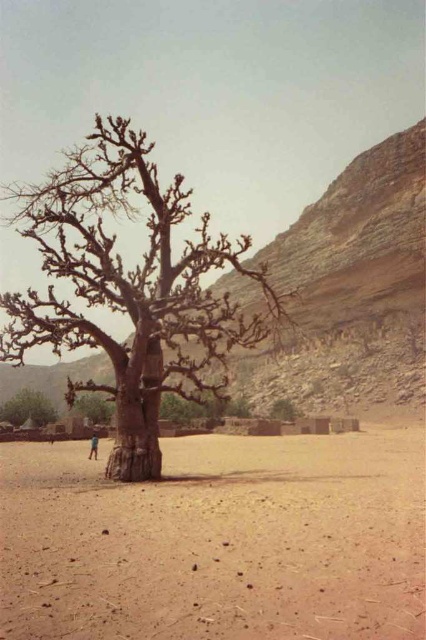
Does brown rough textured tree at center lie behind brown rough bark tree at center?

No, brown rough textured tree at center is in front of brown rough bark tree at center.

Between point (141, 474) and point (284, 406), which one is positioned in front?

Positioned in front is point (141, 474).

Locate an element on the screen. brown rough textured tree at center is located at coordinates (129, 289).

Between brown sandy ground at center and brown rough bark tree at center, which one appears on the right side from the viewer's perspective?

Positioned to the right is brown rough bark tree at center.

Is brown sandy ground at center shorter than brown rough bark tree at center?

Incorrect, brown sandy ground at center's height does not fall short of brown rough bark tree at center's.

Is point (339, 548) in front of point (287, 417)?

Yes.

In order to click on brown sandy ground at center in this screenshot , I will do `click(218, 541)`.

Is point (152, 637) positioned behind point (52, 419)?

No, it is in front of (52, 419).

Does brown sandy ground at center have a lesser height compared to brown rough tree at lower left?

No, brown sandy ground at center is not shorter than brown rough tree at lower left.

Who is more distant from viewer, (155, 595) or (16, 408)?

The point (16, 408) is more distant.

This screenshot has width=426, height=640. I want to click on brown sandy ground at center, so click(x=218, y=541).